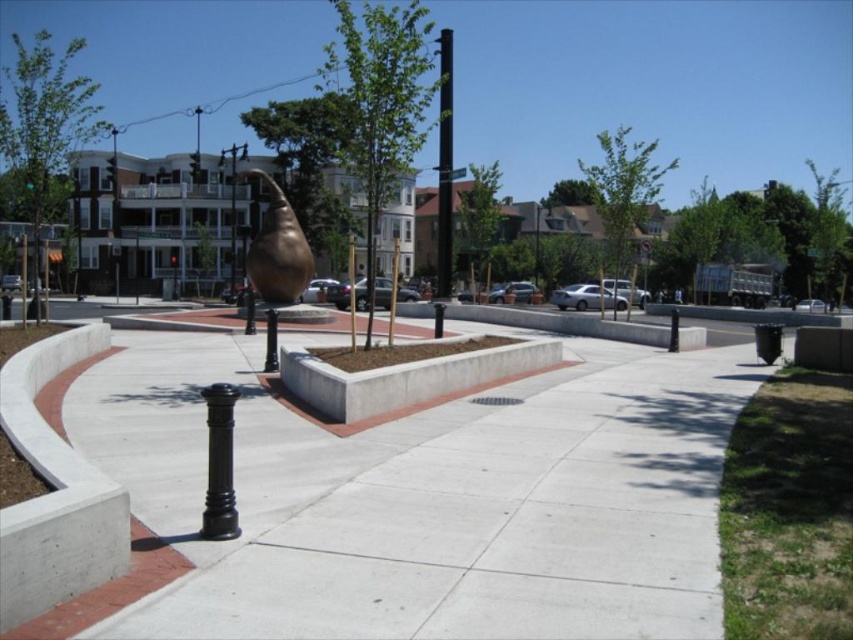
Does point (305, 280) come farther from viewer compared to point (115, 291)?

No, it is not.

Does bronze sculpture at center have a lesser height compared to bronze metallic lamp post at upper left?

Yes.

Does point (285, 292) lie in front of point (119, 202)?

Yes, point (285, 292) is closer to viewer.

Locate an element on the screen. Image resolution: width=853 pixels, height=640 pixels. bronze sculpture at center is located at coordinates (277, 250).

Is black metal pole at center smaller than metallic pole at upper center?

Correct, black metal pole at center occupies less space than metallic pole at upper center.

Is black metal pole at center taller than metallic pole at upper center?

No, black metal pole at center is not taller than metallic pole at upper center.

I want to click on black metal pole at center, so click(444, 168).

Identify the location of black metal pole at center. This screenshot has height=640, width=853. (444, 168).

Can you confirm if bronze metallic lamp post at upper left is positioned below metallic pole at upper center?

No, bronze metallic lamp post at upper left is not below metallic pole at upper center.

Which of these two, bronze metallic lamp post at upper left or metallic pole at upper center, stands shorter?

metallic pole at upper center is shorter.

This screenshot has height=640, width=853. Identify the location of bronze metallic lamp post at upper left. (114, 179).